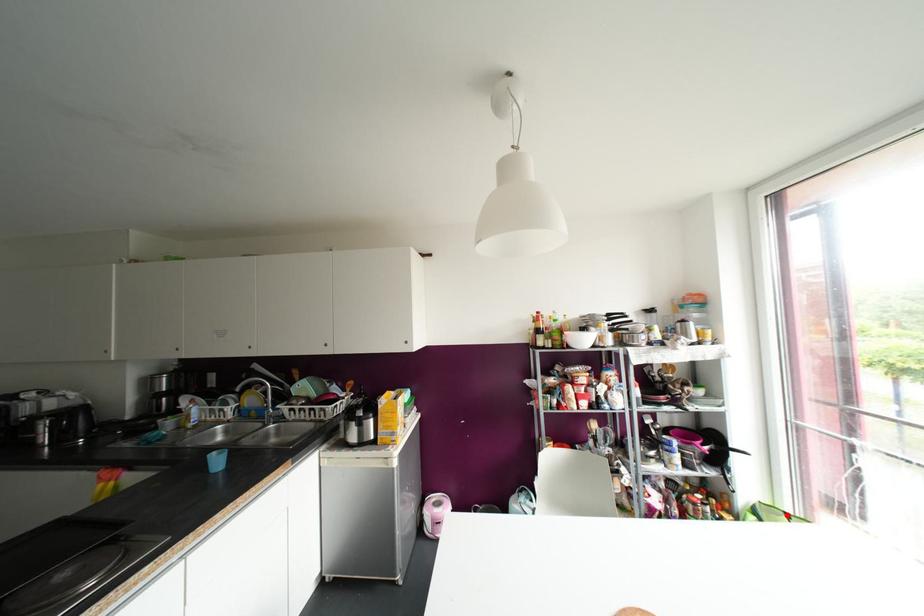
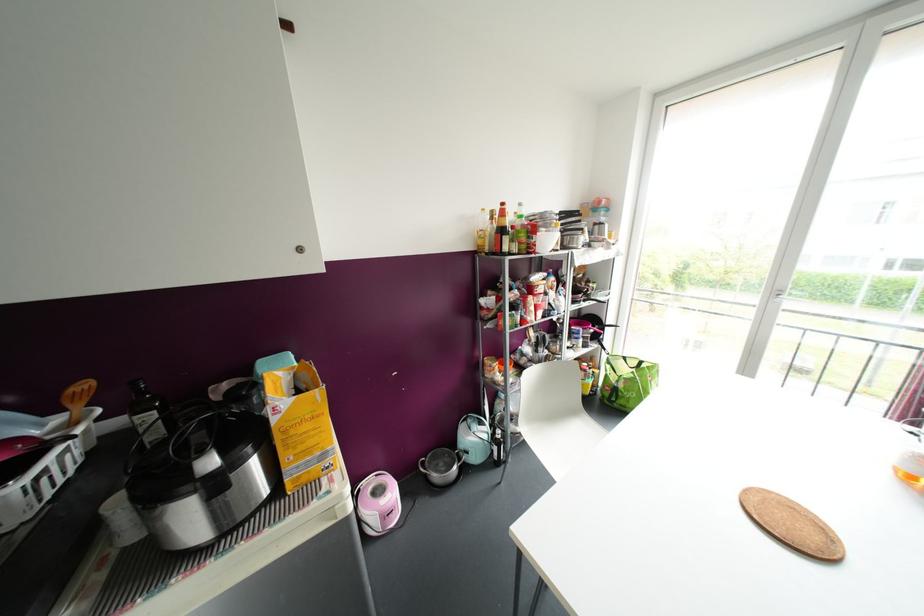
Question: I am providing you with two images of the same scene from different viewpoints. In image1, a red point is highlighted. Considering the same 3D point in image2, which of the following is correct?

Choices:
 (A) It is closer
 (B) It is farther

Answer: (B)